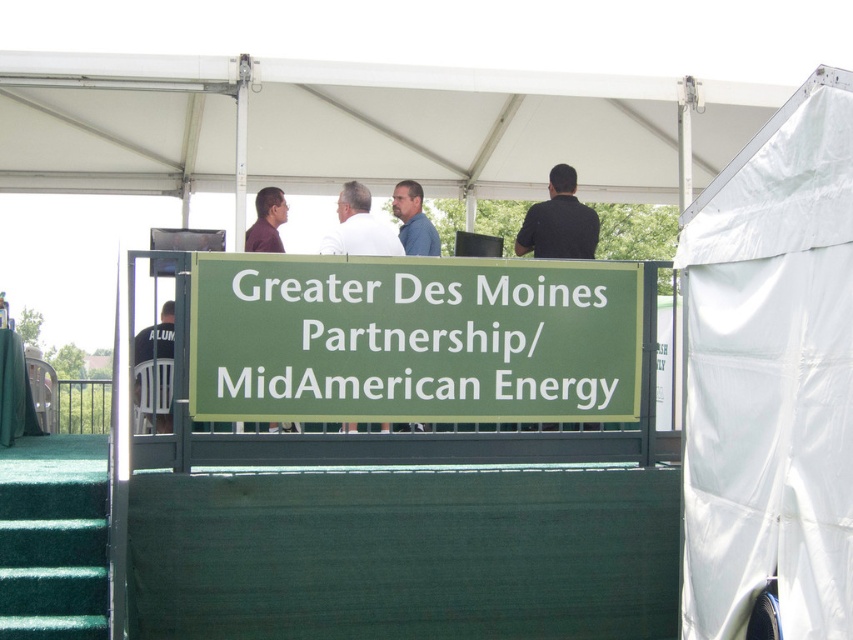
Consider the image. Who is positioned more to the right, white matte shirt at center or matte brown shirt at upper center?

Positioned to the right is white matte shirt at center.

Measure the distance between point (393, 230) and camera.

Point (393, 230) is 8.56 meters away from camera.

Locate an element on the screen. Image resolution: width=853 pixels, height=640 pixels. white matte shirt at center is located at coordinates (358, 227).

Is white fabric canopy at upper center positioned at the back of blue shirt at center?

No, white fabric canopy at upper center is in front of blue shirt at center.

The height and width of the screenshot is (640, 853). Find the location of `white fabric canopy at upper center`. white fabric canopy at upper center is located at coordinates (357, 125).

Measure the distance between white fabric canopy at upper center and camera.

white fabric canopy at upper center and camera are 8.19 meters apart.

Locate an element on the screen. The image size is (853, 640). white fabric canopy at upper center is located at coordinates (357, 125).

What do you see at coordinates (53, 538) in the screenshot? I see `green carpeted stairs at lower left` at bounding box center [53, 538].

Is green carpeted stairs at lower left below black jersey at left?

Indeed, green carpeted stairs at lower left is positioned under black jersey at left.

Is point (0, 596) less distant than point (163, 317)?

Yes, it is in front of point (163, 317).

Locate an element on the screen. green carpeted stairs at lower left is located at coordinates (53, 538).